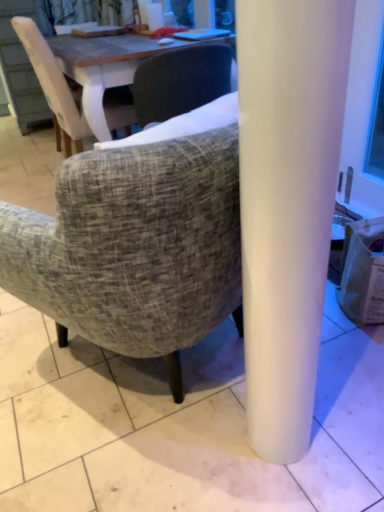
Question: From the image's perspective, does textured fabric chair at center, which is the 2th chair from top to bottom, appear higher than brown paper bag at lower right?

Choices:
 (A) yes
 (B) no

Answer: (A)

Question: Does textured fabric chair at center, the first chair ordered from the bottom, appear on the right side of brown paper bag at lower right?

Choices:
 (A) yes
 (B) no

Answer: (B)

Question: Does textured fabric chair at center, which is the 2th chair from top to bottom, turn towards brown paper bag at lower right?

Choices:
 (A) no
 (B) yes

Answer: (A)

Question: Does textured fabric chair at center, which is the 2th chair from top to bottom, have a lesser height compared to brown paper bag at lower right?

Choices:
 (A) no
 (B) yes

Answer: (A)

Question: Is textured fabric chair at center, the 1th chair positioned from the right, wider than brown paper bag at lower right?

Choices:
 (A) no
 (B) yes

Answer: (B)

Question: Does textured fabric chair at center, placed as the second chair when sorted from left to right, come in front of brown paper bag at lower right?

Choices:
 (A) yes
 (B) no

Answer: (A)

Question: Is light brown fabric chair at upper left, the 2th chair in the front-to-back sequence, closer to camera compared to brown paper bag at lower right?

Choices:
 (A) yes
 (B) no

Answer: (B)

Question: From a real-world perspective, is light brown fabric chair at upper left, which is the second chair from right to left, beneath brown paper bag at lower right?

Choices:
 (A) no
 (B) yes

Answer: (A)

Question: Does light brown fabric chair at upper left, the 2th chair in the front-to-back sequence, have a lesser width compared to brown paper bag at lower right?

Choices:
 (A) no
 (B) yes

Answer: (A)

Question: Considering the relative sizes of light brown fabric chair at upper left, which is the second chair from right to left, and brown paper bag at lower right in the image provided, is light brown fabric chair at upper left, which is the second chair from right to left, taller than brown paper bag at lower right?

Choices:
 (A) no
 (B) yes

Answer: (B)

Question: Is there a large distance between light brown fabric chair at upper left, which is the second chair from right to left, and brown paper bag at lower right?

Choices:
 (A) no
 (B) yes

Answer: (B)

Question: Does light brown fabric chair at upper left, the second chair positioned from the bottom, have a smaller size compared to brown paper bag at lower right?

Choices:
 (A) no
 (B) yes

Answer: (A)

Question: From the image's perspective, is brown paper bag at lower right located above textured fabric chair at center, which is the second chair from back to front?

Choices:
 (A) yes
 (B) no

Answer: (B)